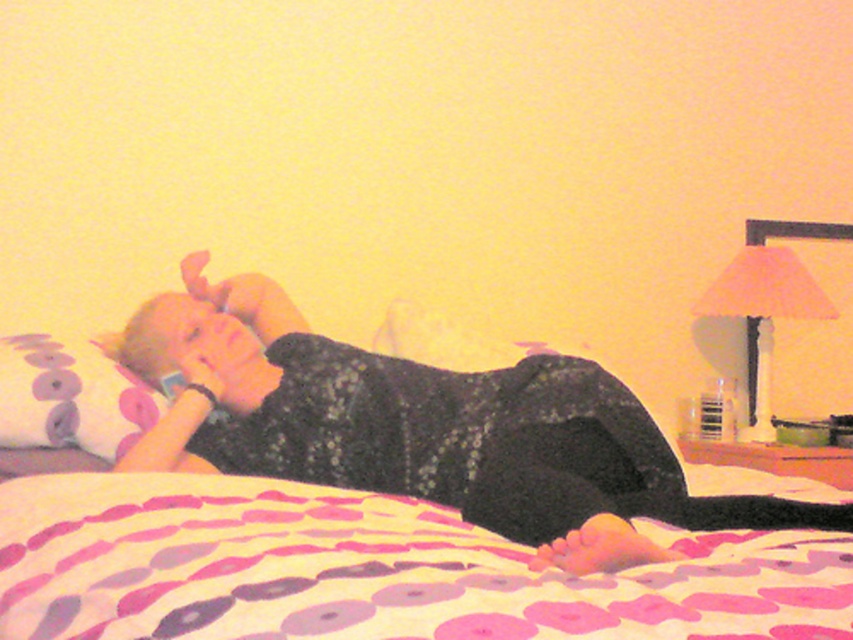
How much distance is there between matte black dress at center and floral fabric pillow at left?

matte black dress at center is 28.51 centimeters away from floral fabric pillow at left.

Which is behind, point (219, 296) or point (120, 432)?

Positioned behind is point (219, 296).

Between point (604, 384) and point (10, 433), which one is positioned in front?

Point (604, 384) is more forward.

Locate an element on the screen. This screenshot has height=640, width=853. matte black dress at center is located at coordinates (422, 429).

Is patterned fabric blanket at center bigger than matte black dress at center?

No, patterned fabric blanket at center is not bigger than matte black dress at center.

Between patterned fabric blanket at center and matte black dress at center, which one appears on the right side from the viewer's perspective?

Positioned to the right is matte black dress at center.

Is point (747, 563) farther from viewer compared to point (833, 524)?

That is False.

At what (x,y) coordinates should I click in order to perform the action: click on patterned fabric blanket at center. Please return your answer as a coordinate pair (x, y). The image size is (853, 640). Looking at the image, I should click on (370, 570).

Can you confirm if patterned fabric blanket at center is taller than floral fabric pillow at left?

No, patterned fabric blanket at center is not taller than floral fabric pillow at left.

You are a GUI agent. You are given a task and a screenshot of the screen. Output one action in this format:
    pyautogui.click(x=<x>, y=<y>)
    Task: Click on the patterned fabric blanket at center
    Image resolution: width=853 pixels, height=640 pixels.
    Given the screenshot: What is the action you would take?
    pyautogui.click(x=370, y=570)

The height and width of the screenshot is (640, 853). Find the location of `patterned fabric blanket at center`. patterned fabric blanket at center is located at coordinates (370, 570).